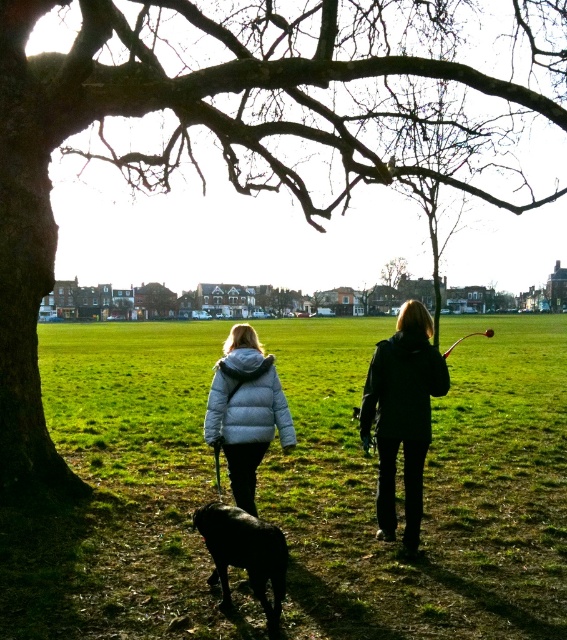
Is black matte jacket at center taller than black matte dog at lower center?

Indeed, black matte jacket at center has a greater height compared to black matte dog at lower center.

Between black matte jacket at center and black matte dog at lower center, which one is positioned lower?

black matte dog at lower center is below.

The height and width of the screenshot is (640, 567). Find the location of `black matte jacket at center`. black matte jacket at center is located at coordinates (403, 413).

You are a GUI agent. You are given a task and a screenshot of the screen. Output one action in this format:
    pyautogui.click(x=<x>, y=<y>)
    Task: Click on the black matte jacket at center
    This screenshot has width=567, height=640.
    Given the screenshot: What is the action you would take?
    pyautogui.click(x=403, y=413)

The width and height of the screenshot is (567, 640). I want to click on green grass at center, so click(x=425, y=486).

Is green grass at center positioned before black matte dog at lower center?

No, green grass at center is further to the viewer.

Is point (52, 413) positioned before point (259, 580)?

No, it is behind (259, 580).

Identify the location of green grass at center. (425, 486).

Can you confirm if white puffy jacket at center is positioned above black matte dog at lower center?

Result: Yes, white puffy jacket at center is above black matte dog at lower center.

This screenshot has height=640, width=567. I want to click on white puffy jacket at center, so click(246, 410).

Locate an element on the screen. The height and width of the screenshot is (640, 567). white puffy jacket at center is located at coordinates (246, 410).

At what (x,y) coordinates should I click in order to perform the action: click on white puffy jacket at center. Please return your answer as a coordinate pair (x, y). The width and height of the screenshot is (567, 640). Looking at the image, I should click on (246, 410).